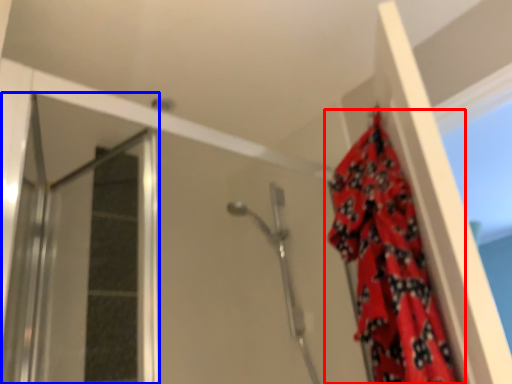
Question: Which point is closer to the camera, curtain (highlighted by a red box) or screen door (highlighted by a blue box)?

Choices:
 (A) curtain
 (B) screen door

Answer: (A)